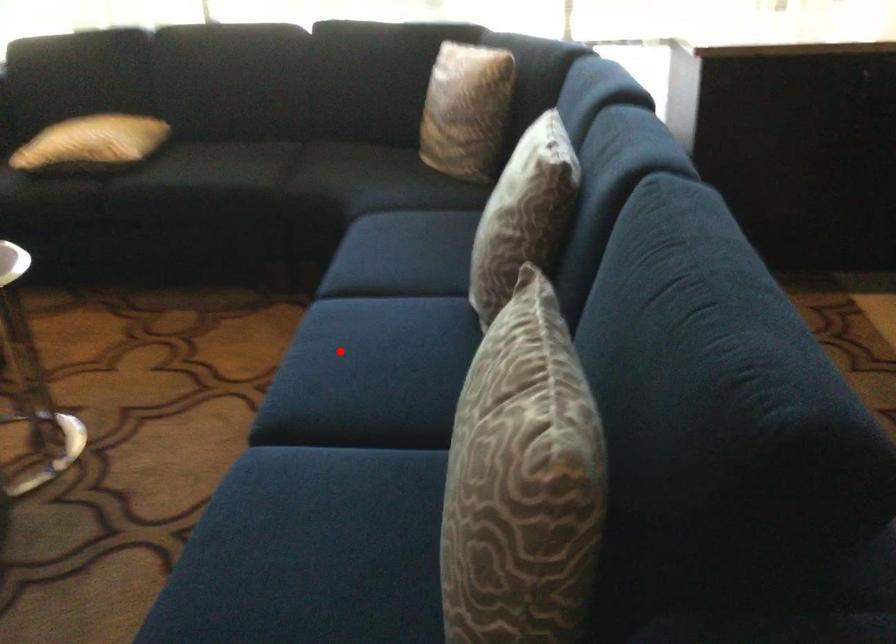
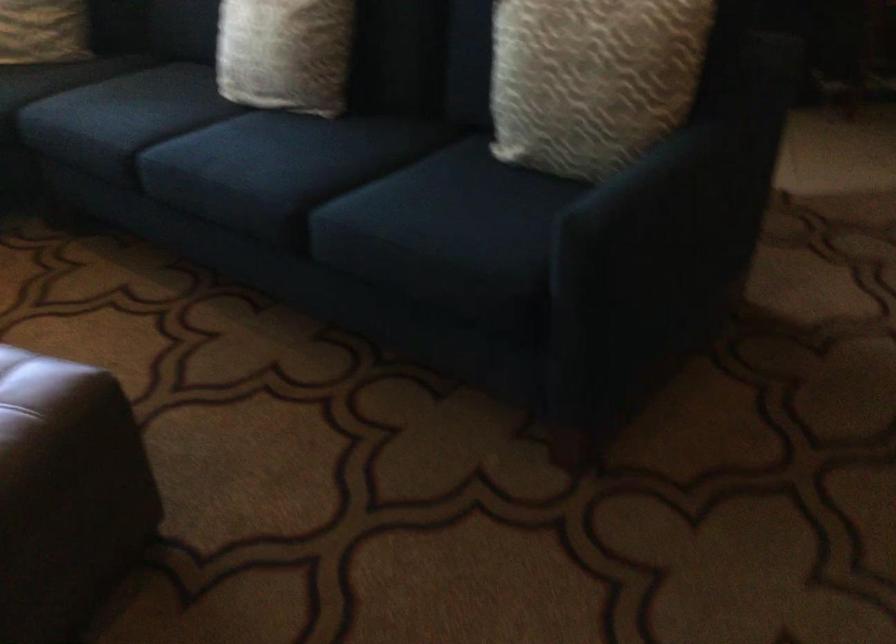
Question: I am providing you with two images of the same scene from different viewpoints. A red point is shown in image1. For the corresponding object point in image2, is it positioned nearer or farther from the camera?

Choices:
 (A) Nearer
 (B) Farther

Answer: (B)